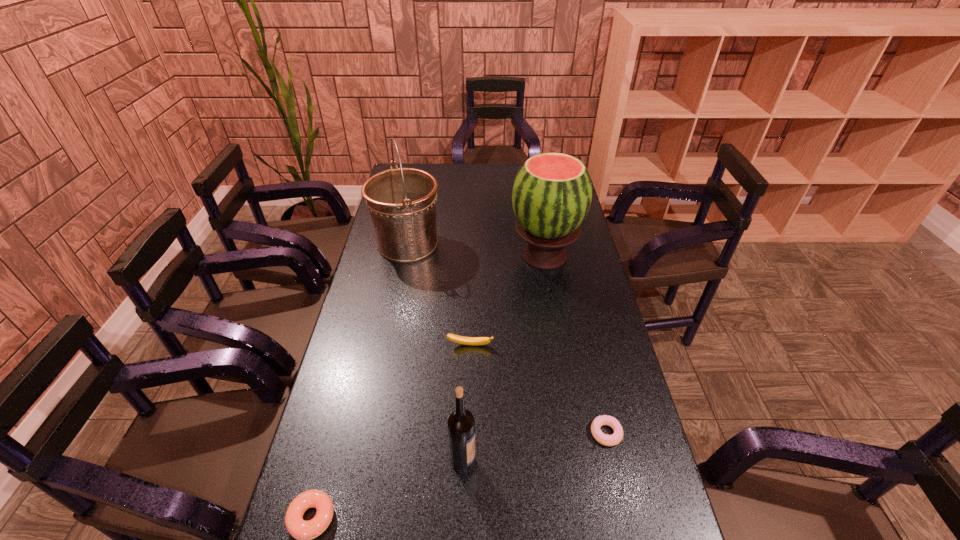
I want to click on bucket, so click(402, 201).

You are a GUI agent. You are given a task and a screenshot of the screen. Output one action in this format:
    pyautogui.click(x=<x>, y=<y>)
    Task: Click on the watermelon
    The image size is (960, 540).
    Given the screenshot: What is the action you would take?
    pyautogui.click(x=552, y=192)

Image resolution: width=960 pixels, height=540 pixels. Identify the location of the fifth farthest object. (461, 426).

Image resolution: width=960 pixels, height=540 pixels. In order to click on wine bottle in this screenshot , I will do `click(461, 426)`.

What are the coordinates of `the fourth nearest object` in the screenshot? It's located at (458, 339).

You are a GUI agent. You are given a task and a screenshot of the screen. Output one action in this format:
    pyautogui.click(x=<x>, y=<y>)
    Task: Click on the banana
    The image size is (960, 540).
    Given the screenshot: What is the action you would take?
    pyautogui.click(x=458, y=339)

You are a GUI agent. You are given a task and a screenshot of the screen. Output one action in this format:
    pyautogui.click(x=<x>, y=<y>)
    Task: Click on the fourth farthest object
    Image resolution: width=960 pixels, height=540 pixels.
    Given the screenshot: What is the action you would take?
    pyautogui.click(x=608, y=440)

Locate an element on the screen. The image size is (960, 540). the right doughnut is located at coordinates (608, 440).

This screenshot has height=540, width=960. I want to click on blank space located on the right of the bucket, so click(470, 244).

Locate an element on the screen. The image size is (960, 540). free spot located 0.210m on the front of the watermelon is located at coordinates coord(556,323).